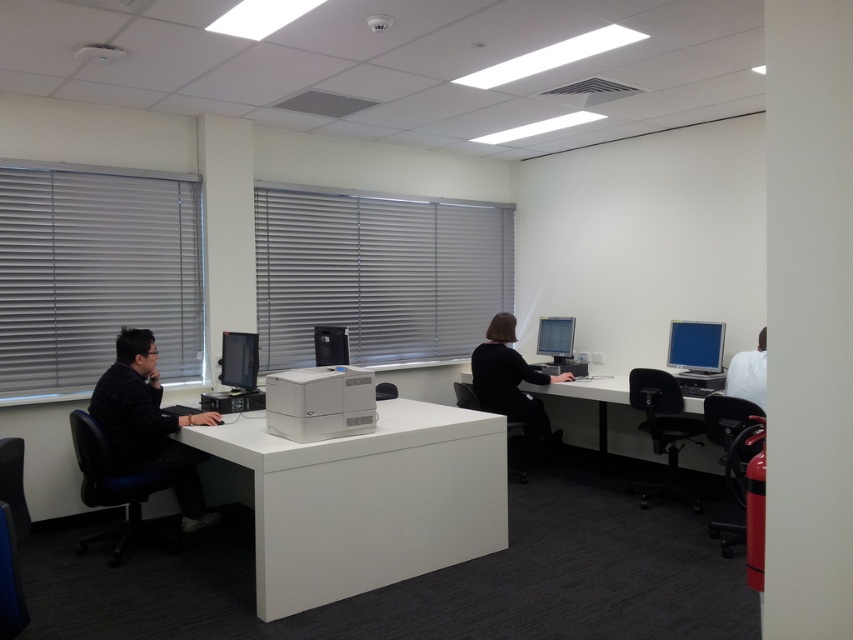
Between silver/textured blinds at center and matte black monitor at right, which one has more height?

Standing taller between the two is silver/textured blinds at center.

Is silver/textured blinds at center taller than matte black monitor at right?

Correct, silver/textured blinds at center is much taller as matte black monitor at right.

Find the location of a particular element. The width and height of the screenshot is (853, 640). silver/textured blinds at center is located at coordinates (376, 275).

Based on the photo, measure the distance between point (753,451) and camera.

They are 12.09 feet apart.

Does point (718, 529) come in front of point (546, 352)?

Yes, it is in front of point (546, 352).

The image size is (853, 640). In order to click on red leather swivel chair at lower right in this screenshot , I will do `click(730, 436)`.

Image resolution: width=853 pixels, height=640 pixels. What are the coordinates of `red leather swivel chair at lower right` in the screenshot? It's located at (730, 436).

Between black leather swivel chair at right and matte black monitor at center, which one has more height?

With more height is black leather swivel chair at right.

Between black leather swivel chair at right and matte black monitor at center, which one appears on the right side from the viewer's perspective?

black leather swivel chair at right is more to the right.

Which is behind, point (659, 392) or point (543, 328)?

Point (543, 328)

Locate an element on the screen. The width and height of the screenshot is (853, 640). black leather swivel chair at right is located at coordinates (662, 429).